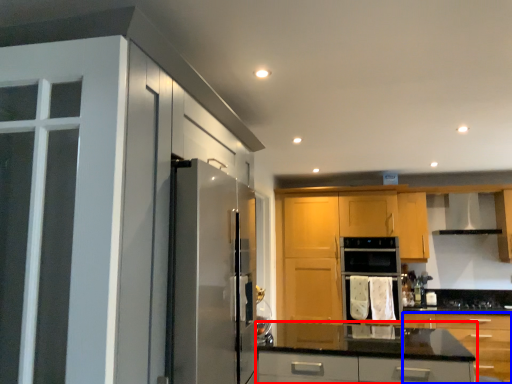
Question: Which object is closer to the camera taking this photo, cabinetry (highlighted by a red box) or cabinetry (highlighted by a blue box)?

Choices:
 (A) cabinetry
 (B) cabinetry

Answer: (B)